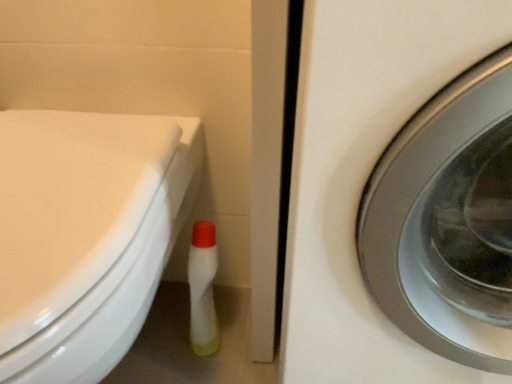
Question: From the image's perspective, relative to white glossy washing machine at center right, is white glossy bidet at lower left above or below?

Choices:
 (A) above
 (B) below

Answer: (B)

Question: From their relative heights in the image, would you say white glossy bidet at lower left is taller or shorter than white glossy washing machine at center right?

Choices:
 (A) short
 (B) tall

Answer: (A)

Question: From a real-world perspective, is white glossy bidet at lower left above or below white glossy washing machine at center right?

Choices:
 (A) below
 (B) above

Answer: (B)

Question: From the image's perspective, is white glossy washing machine at center right above or below white glossy bidet at lower left?

Choices:
 (A) above
 (B) below

Answer: (A)

Question: Considering the positions of point (347, 1) and point (76, 150), is point (347, 1) closer or farther from the camera than point (76, 150)?

Choices:
 (A) closer
 (B) farther

Answer: (A)

Question: Is white glossy washing machine at center right taller or shorter than white glossy bidet at lower left?

Choices:
 (A) short
 (B) tall

Answer: (B)

Question: In terms of width, does white glossy washing machine at center right look wider or thinner when compared to white glossy bidet at lower left?

Choices:
 (A) thin
 (B) wide

Answer: (B)